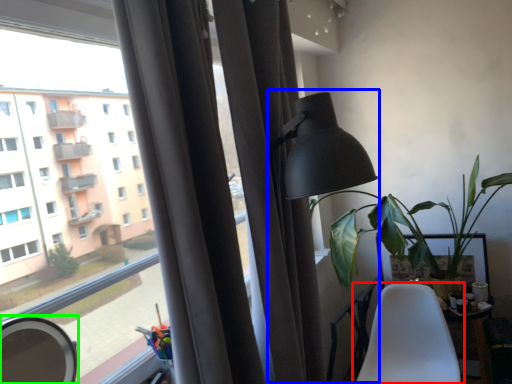
Question: Which object is the farthest from chair (highlighted by a red box)? Choose among these: table lamp (highlighted by a blue box) or mirror (highlighted by a green box).

Choices:
 (A) table lamp
 (B) mirror

Answer: (B)